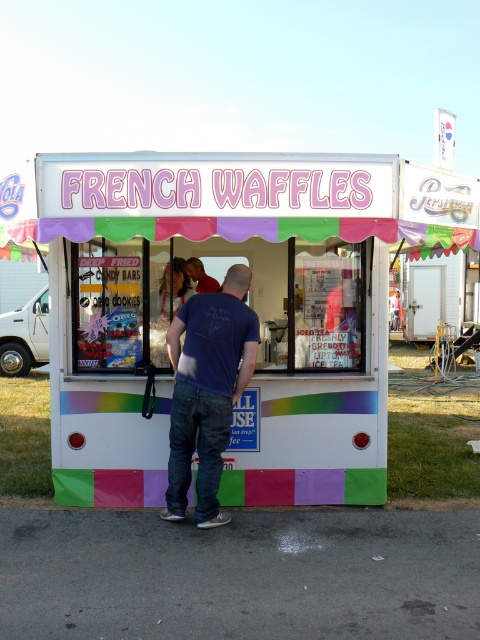
You are a customer waiting in line at the French waffle stall. You notice the pastel painted food truck at center and the blonde hair at center. Which one is higher up?

The blonde hair at center is higher up since the pastel painted food truck at center is located below it.

You are at the French waffle stall and need to locate two points marked on the menu board. The first point is at coordinates point (156, 464) and the second at point (199, 508). From your perspective standing in front of the stall, which point is closer to you?

Point (199, 508) is closer to you since it is in front of point (156, 464).